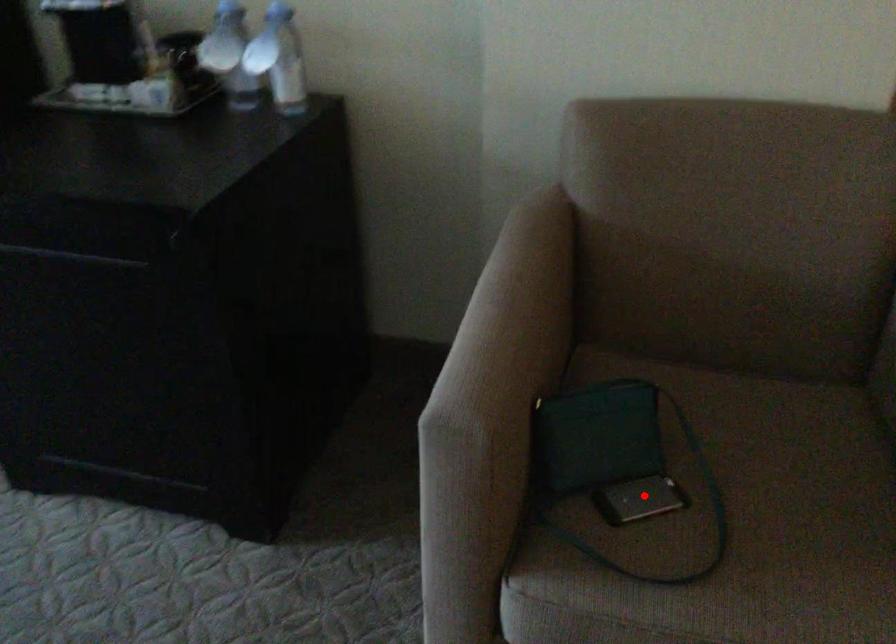
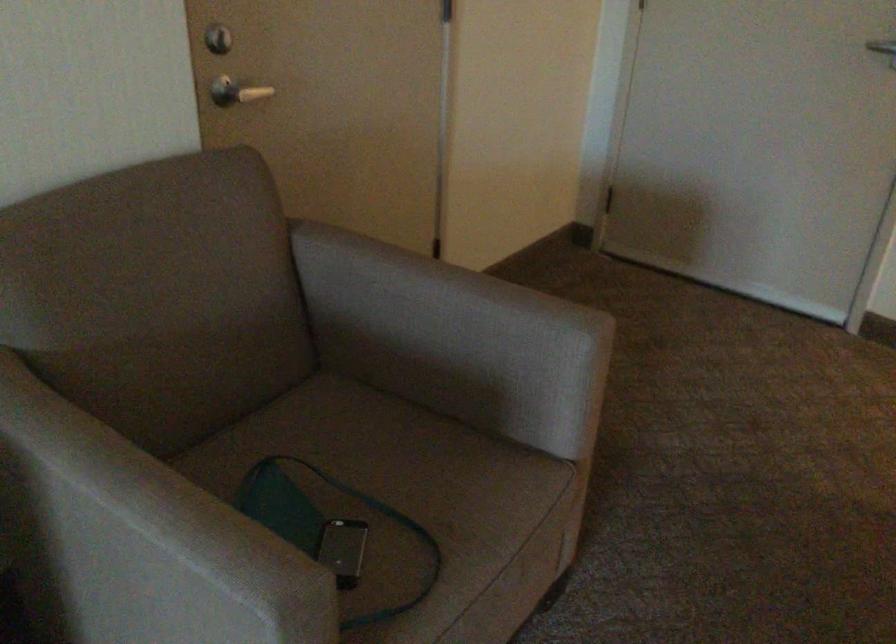
Locate, in the second image, the point that corresponds to the highlighted location in the first image.

(342, 550)